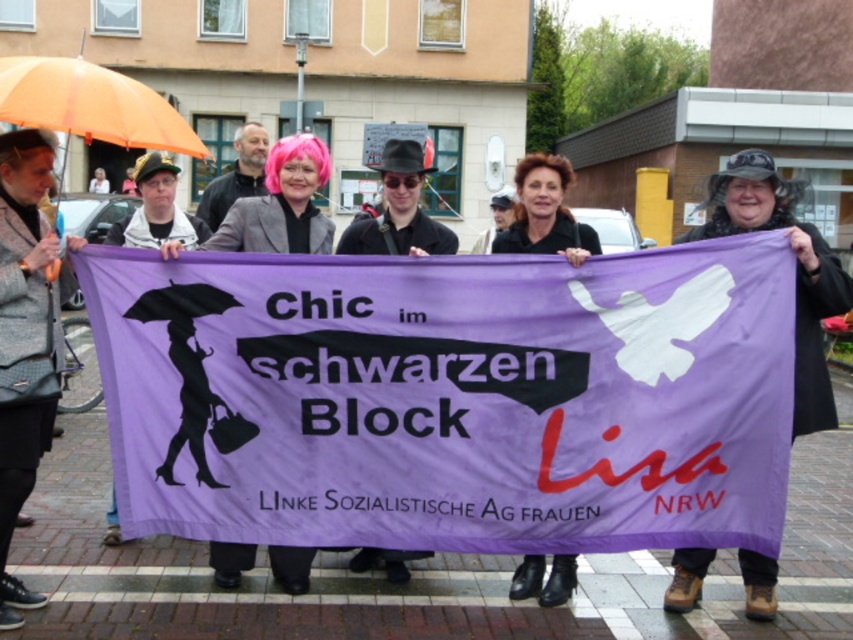
Question: Does purple fabric banner at center appear over pink hair at center?

Choices:
 (A) yes
 (B) no

Answer: (B)

Question: Which of these objects is positioned closest to the matte black jacket at center?

Choices:
 (A) orange fabric umbrella at upper left
 (B) black matte coat at center

Answer: (B)

Question: Estimate the real-world distances between objects in this image. Which object is closer to the black matte coat at center?

Choices:
 (A) matte black jacket at center
 (B) gray wool coat at center
 (C) pink hair at center
 (D) orange fabric umbrella at upper left

Answer: (A)

Question: Which point appears closest to the camera in this image?

Choices:
 (A) (299, 132)
 (B) (125, 90)

Answer: (B)

Question: Can you confirm if gray wool coat at center is wider than pink hair at center?

Choices:
 (A) no
 (B) yes

Answer: (A)

Question: Does purple fabric banner at center have a larger size compared to black matte coat at center?

Choices:
 (A) yes
 (B) no

Answer: (A)